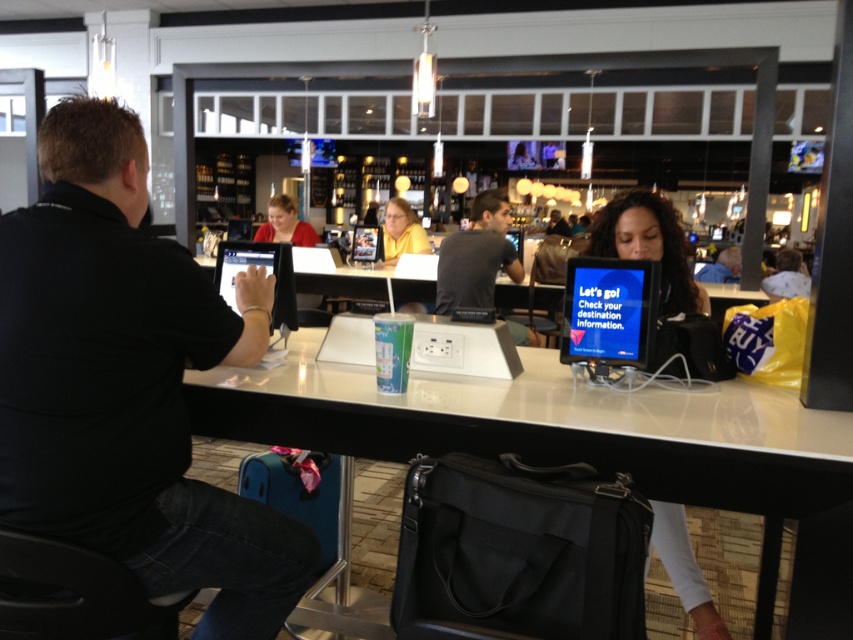
Question: Which object is farther from the camera taking this photo?

Choices:
 (A) white glossy table at center
 (B) yellow matte shirt at center
 (C) matte black shirt at center
 (D) light blue fabric shirt at upper right

Answer: (C)

Question: Considering the real-world distances, which object is farthest from the dark gray shirt at center?

Choices:
 (A) light blue fabric shirt at upper right
 (B) yellow matte shirt at center
 (C) blue glossy monitor at center
 (D) matte black shirt at center

Answer: (D)

Question: Is white glossy table at center smaller than matte black laptop at center?

Choices:
 (A) no
 (B) yes

Answer: (A)

Question: Is white glossy table at center bigger than matte red shirt at center?

Choices:
 (A) yes
 (B) no

Answer: (A)

Question: Does dark gray shirt at center have a lesser width compared to light blue fabric shirt at upper right?

Choices:
 (A) yes
 (B) no

Answer: (A)

Question: Estimate the real-world distances between objects in this image. Which object is farther from the matte red shirt at center?

Choices:
 (A) yellow matte shirt at center
 (B) white glossy table at center
 (C) matte black shirt at center
 (D) matte black laptop at center

Answer: (C)